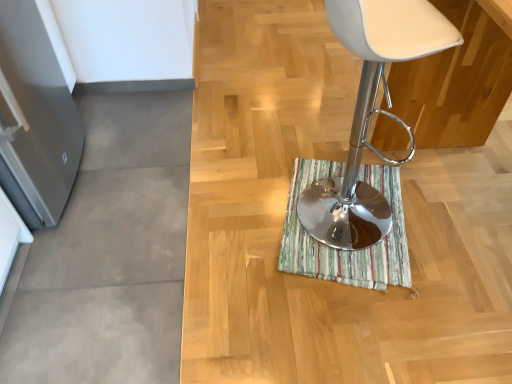
Find the location of a particular element. This screenshot has width=512, height=384. blank space to the left of striped fabric bath mat at center is located at coordinates (240, 249).